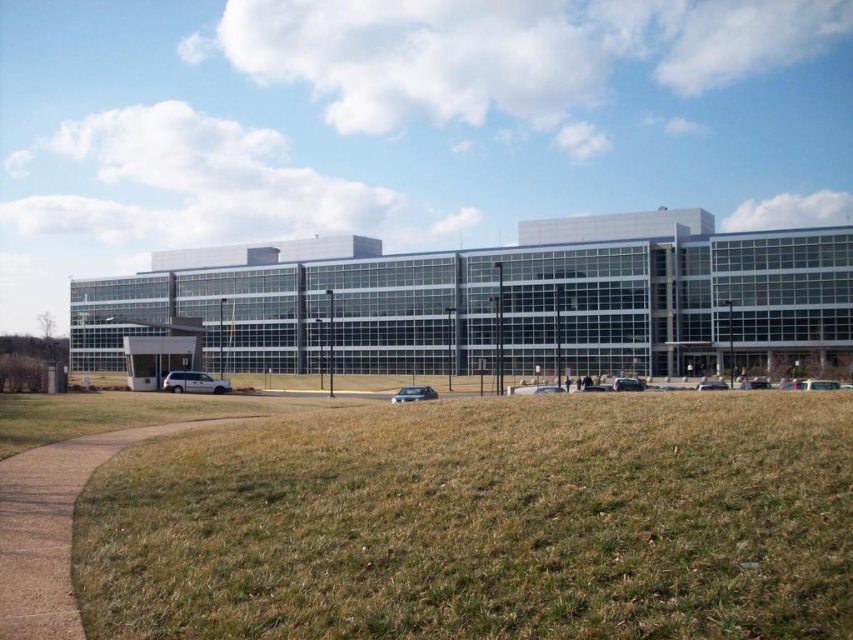
Question: Is transparent glass building at center positioned behind white matte van at center?

Choices:
 (A) yes
 (B) no

Answer: (A)

Question: Based on their relative distances, which object is farther from the brown dry grass at lower left?

Choices:
 (A) transparent glass building at center
 (B) satin silver sedan at center
 (C) white matte van at center

Answer: (A)

Question: Considering the relative positions of brown dry grass at lower left and satin silver sedan at center in the image provided, where is brown dry grass at lower left located with respect to satin silver sedan at center?

Choices:
 (A) above
 (B) below

Answer: (A)

Question: Does white matte van at center have a smaller size compared to satin silver sedan at center?

Choices:
 (A) yes
 (B) no

Answer: (A)

Question: Which object is the farthest from the satin silver sedan at center?

Choices:
 (A) white matte van at center
 (B) transparent glass building at center

Answer: (B)

Question: Based on their relative distances, which object is nearer to the transparent glass building at center?

Choices:
 (A) brown dry grass at lower left
 (B) white matte van at center

Answer: (B)